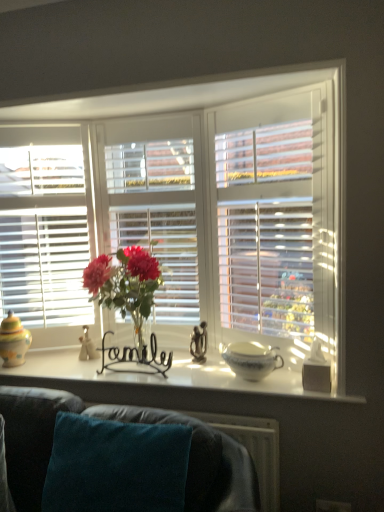
Question: From the image's perspective, is white glossy window sill at center over teal fabric couch at lower center?

Choices:
 (A) no
 (B) yes

Answer: (B)

Question: Does white glossy window sill at center have a greater width compared to teal fabric couch at lower center?

Choices:
 (A) no
 (B) yes

Answer: (A)

Question: Considering the relative sizes of white glossy window sill at center and teal fabric couch at lower center in the image provided, is white glossy window sill at center smaller than teal fabric couch at lower center?

Choices:
 (A) yes
 (B) no

Answer: (A)

Question: Is white glossy window sill at center outside of teal fabric couch at lower center?

Choices:
 (A) no
 (B) yes

Answer: (B)

Question: Is white glossy window sill at center further to the viewer compared to teal fabric couch at lower center?

Choices:
 (A) no
 (B) yes

Answer: (B)

Question: Can you confirm if white glossy window sill at center is bigger than teal fabric couch at lower center?

Choices:
 (A) yes
 (B) no

Answer: (B)

Question: Is white ceramic bowl at center aimed at white matte tissue box at right, which ranks as the 3th candle holder in back-to-front order?

Choices:
 (A) yes
 (B) no

Answer: (B)

Question: Considering the relative sizes of white ceramic bowl at center and white matte tissue box at right, the first candle holder positioned from the right, in the image provided, is white ceramic bowl at center wider than white matte tissue box at right, the first candle holder positioned from the right,?

Choices:
 (A) no
 (B) yes

Answer: (B)

Question: Does white ceramic bowl at center come in front of white matte tissue box at right, the 1th candle holder in the front-to-back sequence?

Choices:
 (A) yes
 (B) no

Answer: (B)

Question: Can you confirm if white ceramic bowl at center is positioned to the right of white matte tissue box at right, placed as the 3th candle holder when sorted from left to right?

Choices:
 (A) yes
 (B) no

Answer: (B)

Question: Is white ceramic bowl at center taller than white matte tissue box at right, the 1th candle holder in the front-to-back sequence?

Choices:
 (A) no
 (B) yes

Answer: (A)

Question: Is white ceramic bowl at center far from white matte tissue box at right, which ranks as the 3th candle holder in back-to-front order?

Choices:
 (A) no
 (B) yes

Answer: (A)

Question: Is white ceramic bowl at center completely or partially outside of black wire at center, the 2th candle holder when ordered from left to right?

Choices:
 (A) yes
 (B) no

Answer: (A)